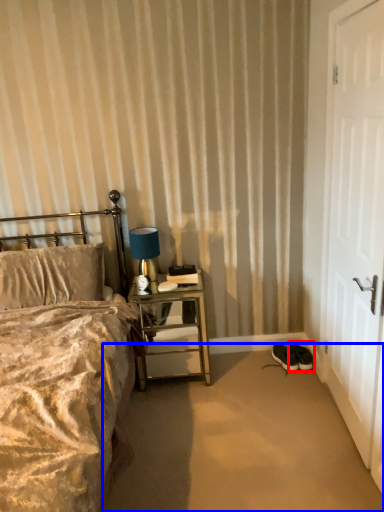
Question: Which point is closer to the camera, footwear (highlighted by a red box) or plain (highlighted by a blue box)?

Choices:
 (A) footwear
 (B) plain

Answer: (B)